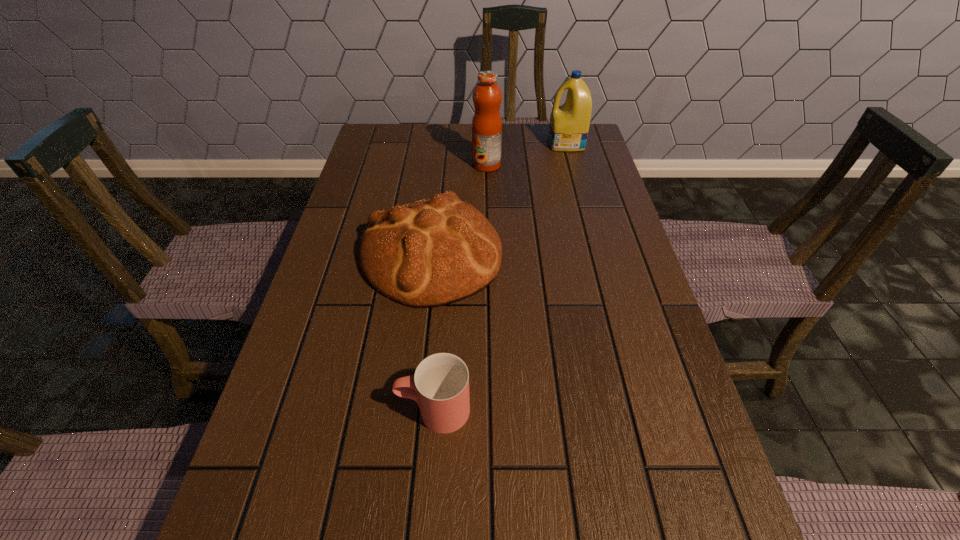
Find the location of a particular element. vacant point located between the third shortest object and the third farthest object is located at coordinates (498, 199).

This screenshot has width=960, height=540. In order to click on free spot between the nearest object and the detergent in this screenshot , I will do `click(500, 276)`.

Locate an element on the screen. This screenshot has width=960, height=540. free space between the detergent and the third nearest object is located at coordinates (526, 154).

Find the location of a particular element. This screenshot has height=540, width=960. free space between the nearest object and the third farthest object is located at coordinates (432, 332).

I want to click on object that can be found as the third closest to the tallest object, so click(440, 386).

You are a GUI agent. You are given a task and a screenshot of the screen. Output one action in this format:
    pyautogui.click(x=<x>, y=<y>)
    Task: Click on the object that is the closest to the rightmost object
    
    Given the screenshot: What is the action you would take?
    pyautogui.click(x=487, y=96)

Where is `vacant region that satisfies the following two spatial constraints: 1. on the label of the second tallest object; 2. on the front side of the third farthest object`? This screenshot has height=540, width=960. vacant region that satisfies the following two spatial constraints: 1. on the label of the second tallest object; 2. on the front side of the third farthest object is located at coordinates (596, 255).

Where is `free space in the image that satisfies the following two spatial constraints: 1. on the label of the rightmost object; 2. on the front side of the third farthest object`? This screenshot has width=960, height=540. free space in the image that satisfies the following two spatial constraints: 1. on the label of the rightmost object; 2. on the front side of the third farthest object is located at coordinates pos(596,255).

Where is `vacant point that satisfies the following two spatial constraints: 1. on the front label of the fruit juice; 2. on the front side of the bread`? vacant point that satisfies the following two spatial constraints: 1. on the front label of the fruit juice; 2. on the front side of the bread is located at coordinates (489, 255).

What are the coordinates of `vacant space that satisfies the following two spatial constraints: 1. on the front side of the third farthest object; 2. on the side of the nearest object with the handle` in the screenshot? It's located at (414, 410).